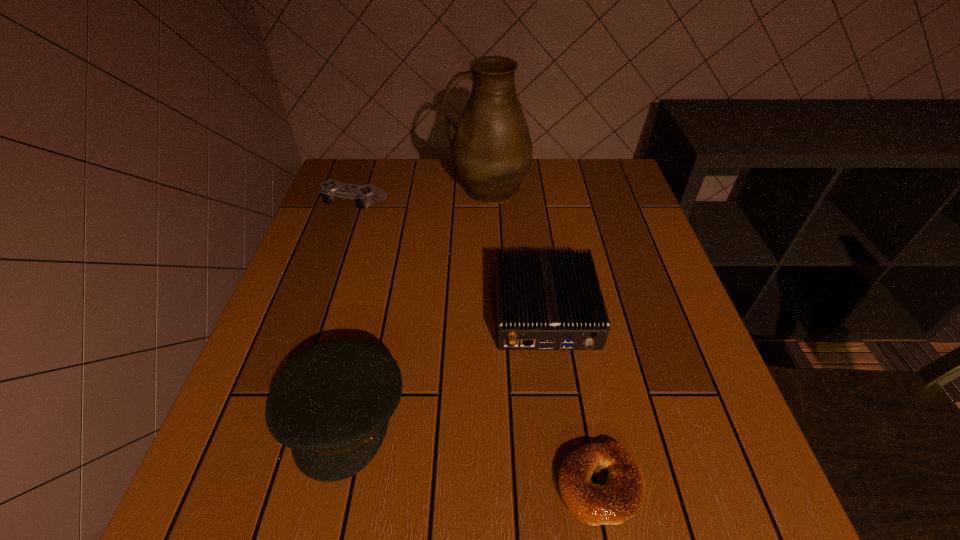
The height and width of the screenshot is (540, 960). What are the coordinates of `free space at the far edge of the desktop` in the screenshot? It's located at (564, 172).

Locate an element on the screen. The image size is (960, 540). vacant space at the left edge of the desktop is located at coordinates (353, 274).

The width and height of the screenshot is (960, 540). In order to click on free space at the right edge in this screenshot , I will do `click(603, 245)`.

You are a GUI agent. You are given a task and a screenshot of the screen. Output one action in this format:
    pyautogui.click(x=<x>, y=<y>)
    Task: Click on the free location at the far left corner
    This screenshot has width=960, height=540.
    Given the screenshot: What is the action you would take?
    pyautogui.click(x=373, y=205)

At what (x,y) coordinates should I click in order to perform the action: click on vacant area at the near left corner. Please return your answer as a coordinate pair (x, y). Looking at the image, I should click on 203,489.

Locate an element on the screen. vacant region at the far right corner of the desktop is located at coordinates (598, 177).

Where is `free spot between the third shortest object and the fourth tallest object`? The image size is (960, 540). free spot between the third shortest object and the fourth tallest object is located at coordinates (450, 256).

Find the location of a particular element. The width and height of the screenshot is (960, 540). blank region between the bagel and the fourth tallest object is located at coordinates (478, 343).

Locate an element on the screen. The image size is (960, 540). free space between the beret and the third tallest object is located at coordinates (444, 362).

Identify the location of empty space that is in between the second shortest object and the beret. This screenshot has width=960, height=540. (350, 308).